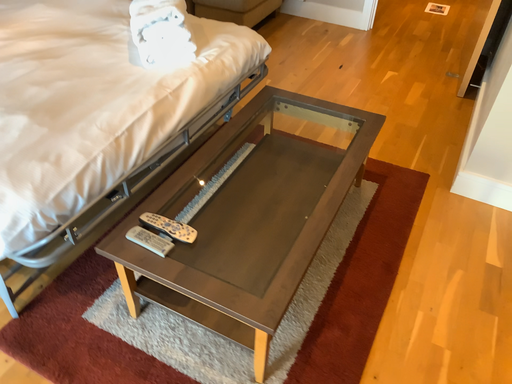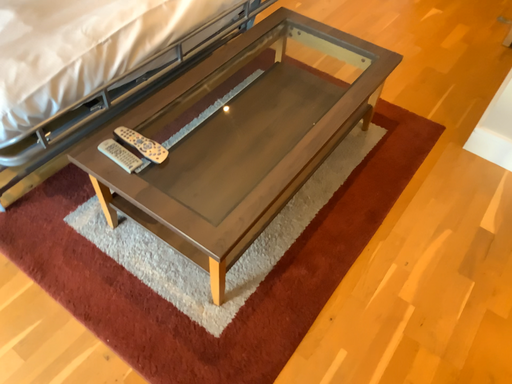
Question: Which way did the camera rotate in the video?

Choices:
 (A) rotated downward
 (B) rotated upward

Answer: (A)